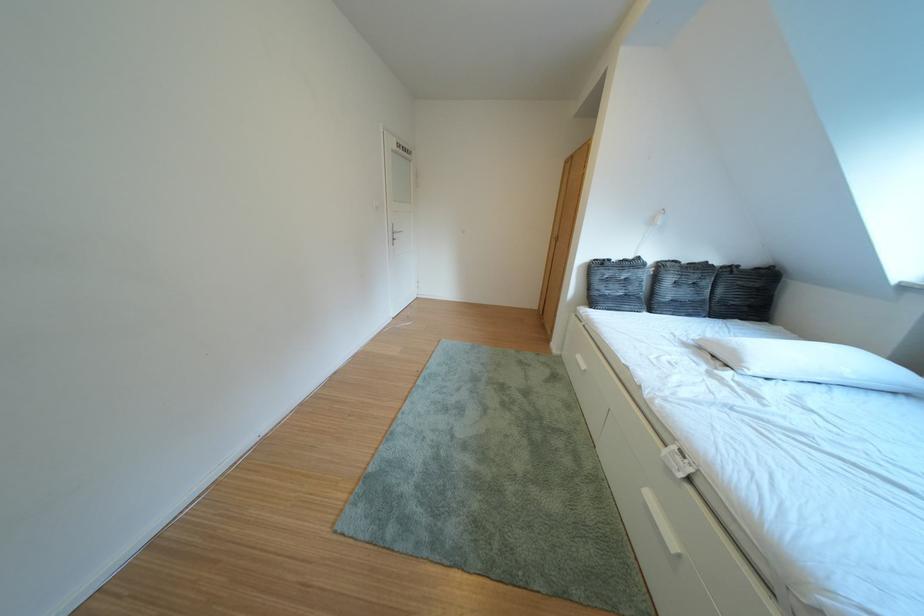
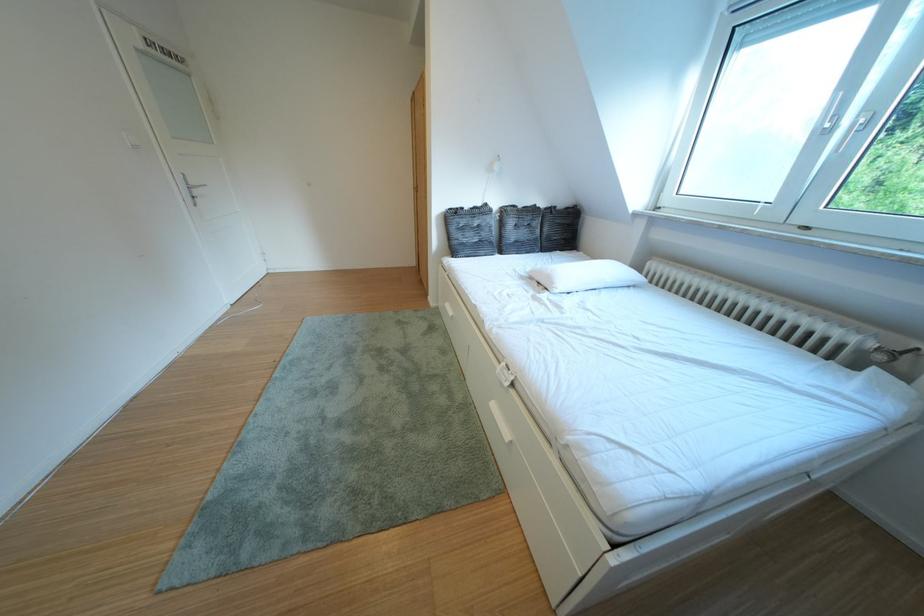
Locate, in the second image, the point that corresponds to point 755,366 in the first image.

(565, 288)